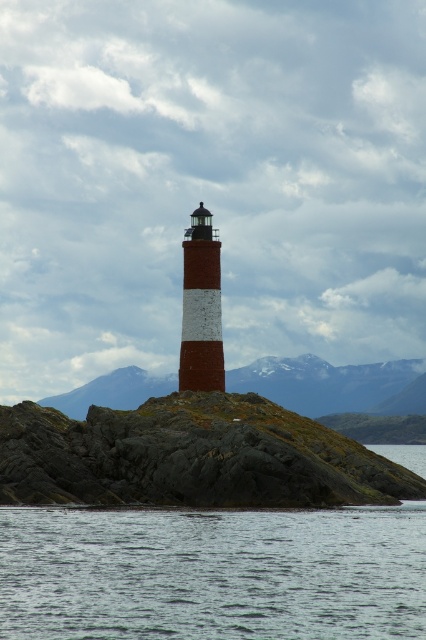
Question: Which of the following is the closest to the observer?

Choices:
 (A) (34, 540)
 (B) (9, 474)

Answer: (A)

Question: Which of the following is the closest to the observer?

Choices:
 (A) (193, 214)
 (B) (342, 451)
 (C) (255, 579)

Answer: (C)

Question: Can you confirm if rough granite rock at center is positioned above brick textured lighthouse at center?

Choices:
 (A) no
 (B) yes

Answer: (A)

Question: In this image, where is rough granite rock at center located relative to brick textured lighthouse at center?

Choices:
 (A) right
 (B) left

Answer: (A)

Question: Does rough granite rock at center appear on the right side of brick textured lighthouse at center?

Choices:
 (A) yes
 (B) no

Answer: (A)

Question: Which is farther from the brick textured lighthouse at center?

Choices:
 (A) rough granite rock at center
 (B) gray water at lower center

Answer: (B)